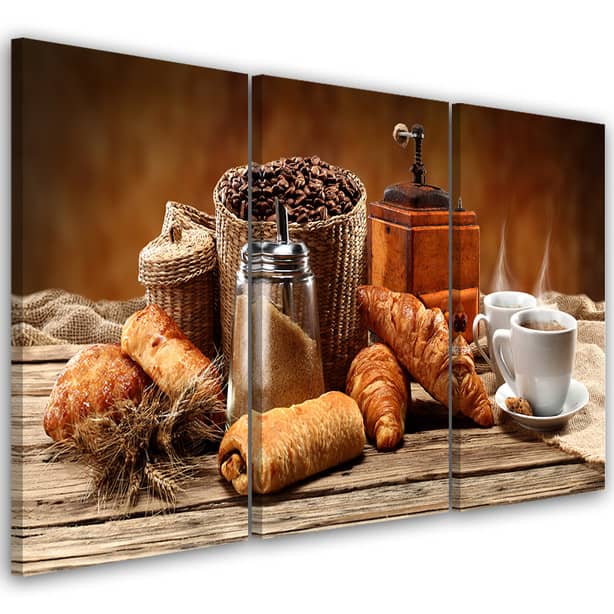
Find the location of a particular element. The height and width of the screenshot is (614, 614). white coffee mugs is located at coordinates (538, 347), (497, 314).